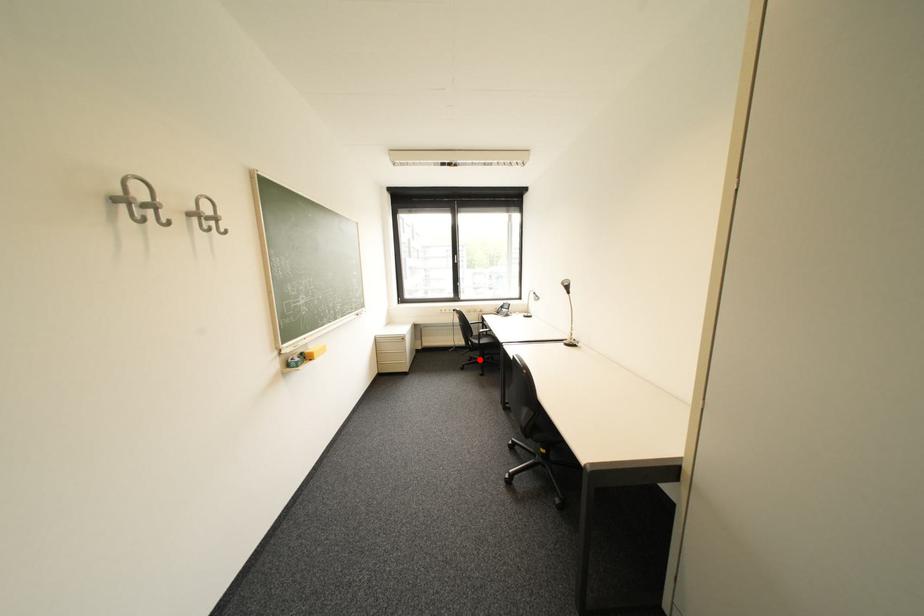
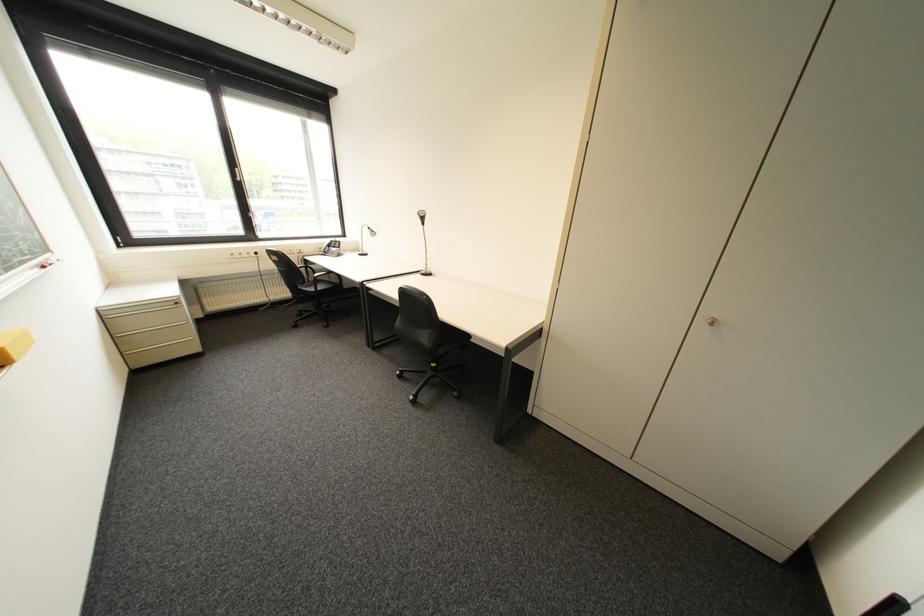
Question: I am providing you with two images of the same scene from different viewpoints. A red point is marked on the first image. Is the red point's position out of view in image 2?

Choices:
 (A) Yes
 (B) No

Answer: (B)